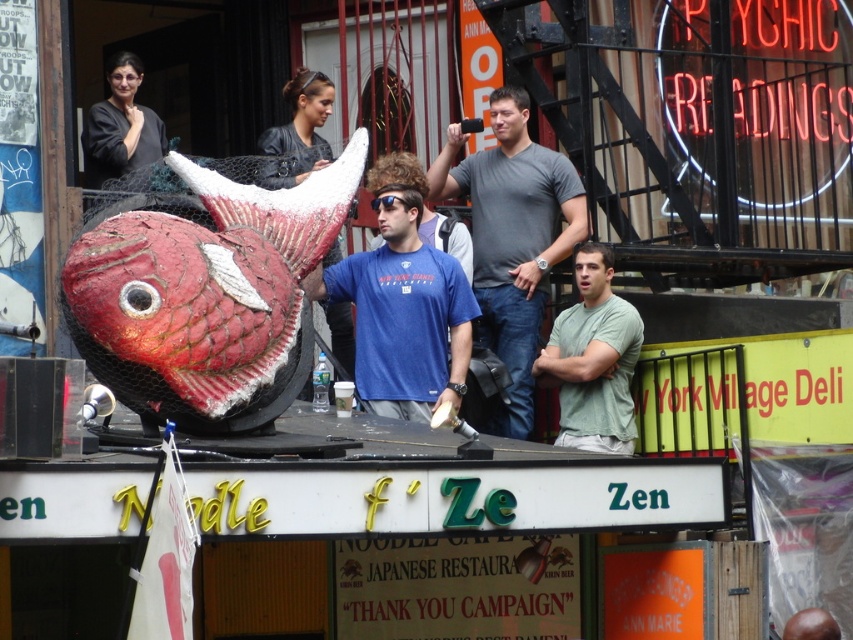
You are a fashion designer observing the crowd in the street scene. You notice two shirts in the crowd. Which shirt has a smaller size between the green matte shirt at center and the matte black shirt at upper left?

The green matte shirt at center is smaller than the matte black shirt at upper left.